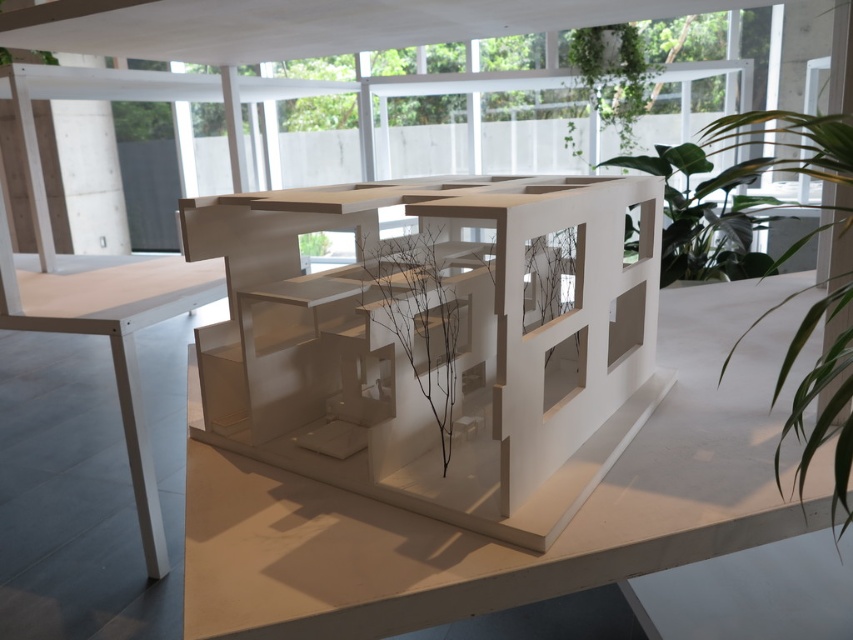
Question: Which point is farther to the camera?

Choices:
 (A) (19, 280)
 (B) (682, 257)

Answer: (B)

Question: Is brown matte branch at center below green matte plant at upper right?

Choices:
 (A) no
 (B) yes

Answer: (B)

Question: Which point is closer to the camera?

Choices:
 (A) (805, 132)
 (B) (595, 60)
 (C) (624, 157)

Answer: (A)

Question: Among these objects, which one is farthest from the camera?

Choices:
 (A) green leafy plant at upper right
 (B) white matte table at left
 (C) brown matte branch at center
 (D) green matte plant at upper right

Answer: (B)

Question: Is the position of white matte table at left less distant than that of green leafy plant at upper center?

Choices:
 (A) no
 (B) yes

Answer: (B)

Question: Is the position of white matte table at left less distant than that of green leafy plant at center?

Choices:
 (A) no
 (B) yes

Answer: (B)